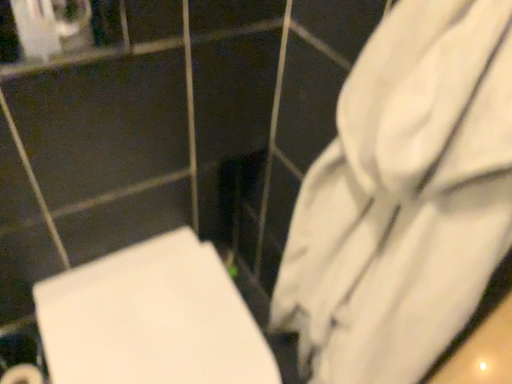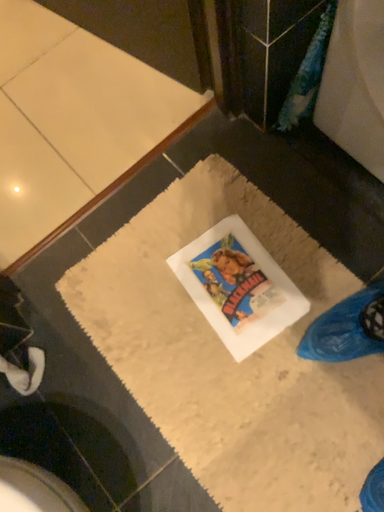
Question: Which way did the camera rotate in the video?

Choices:
 (A) rotated upward
 (B) rotated downward

Answer: (A)